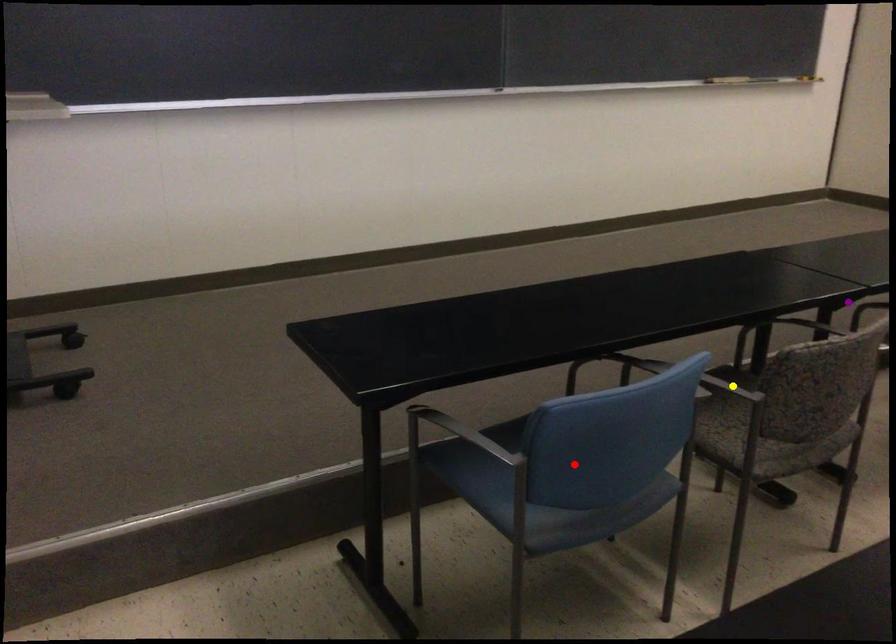
Order these from nearest to farthest:
red point
purple point
yellow point

red point → yellow point → purple point